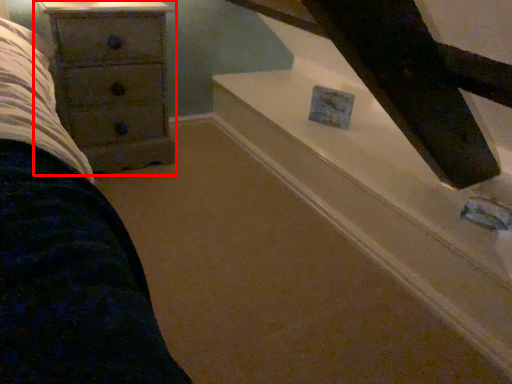
Question: From the image's perspective, where is chest of drawers (annotated by the red box) located in relation to stairwell in the image?

Choices:
 (A) above
 (B) below

Answer: (A)